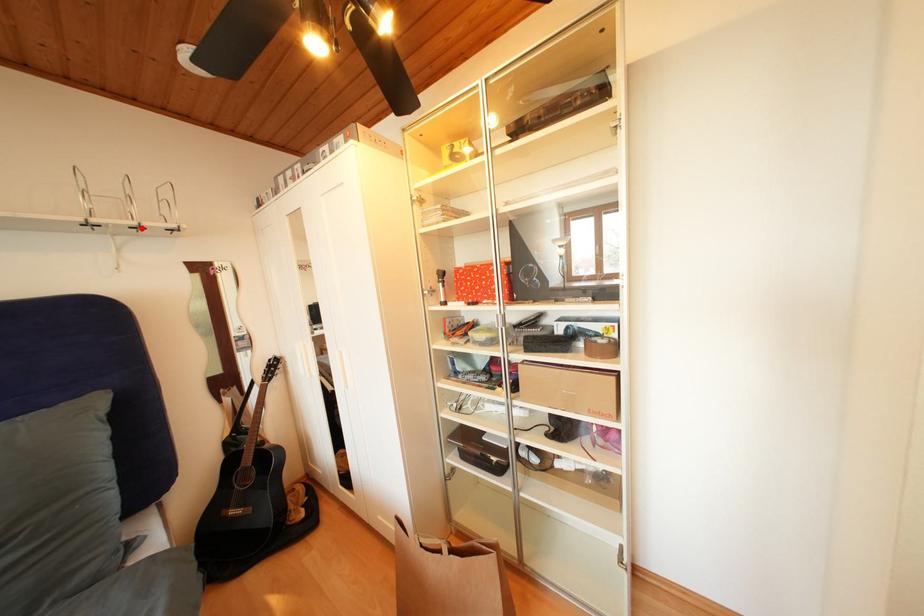
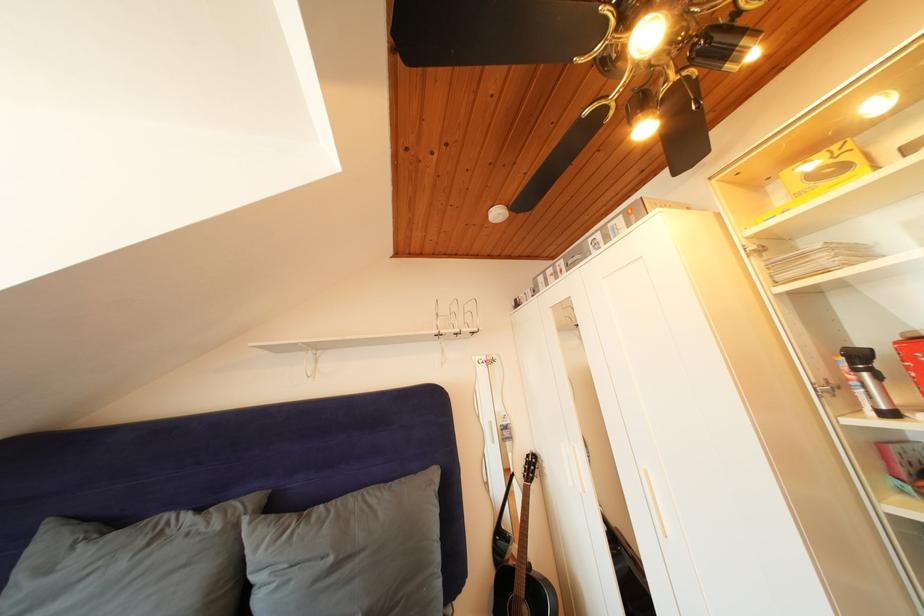
In the second image, find the point that corresponds to the highlighted location in the first image.

(466, 336)